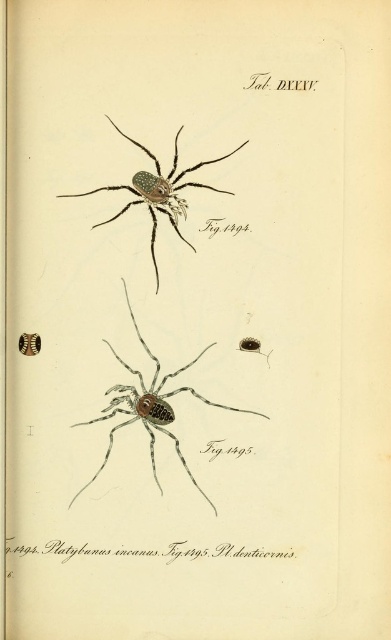
Is brown matte spider at center below shiny metallic spider at upper center?

Correct, brown matte spider at center is located below shiny metallic spider at upper center.

Does point (132, 397) lie behind point (109, 218)?

Yes, point (132, 397) is farther from viewer.

Does point (156, 401) lie in front of point (157, 186)?

No, (156, 401) is further to viewer.

Find the location of a particular element. brown matte spider at center is located at coordinates click(x=150, y=406).